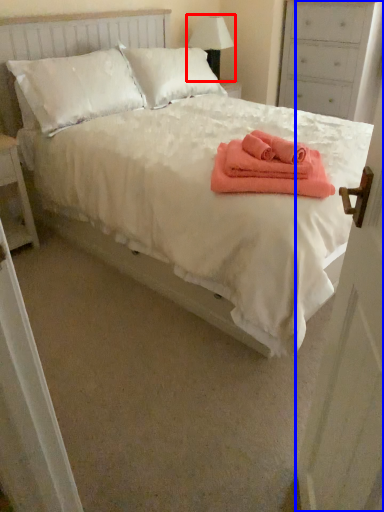
Question: Which of the following is the farthest to the observer, table lamp (highlighted by a red box) or door (highlighted by a blue box)?

Choices:
 (A) table lamp
 (B) door

Answer: (A)